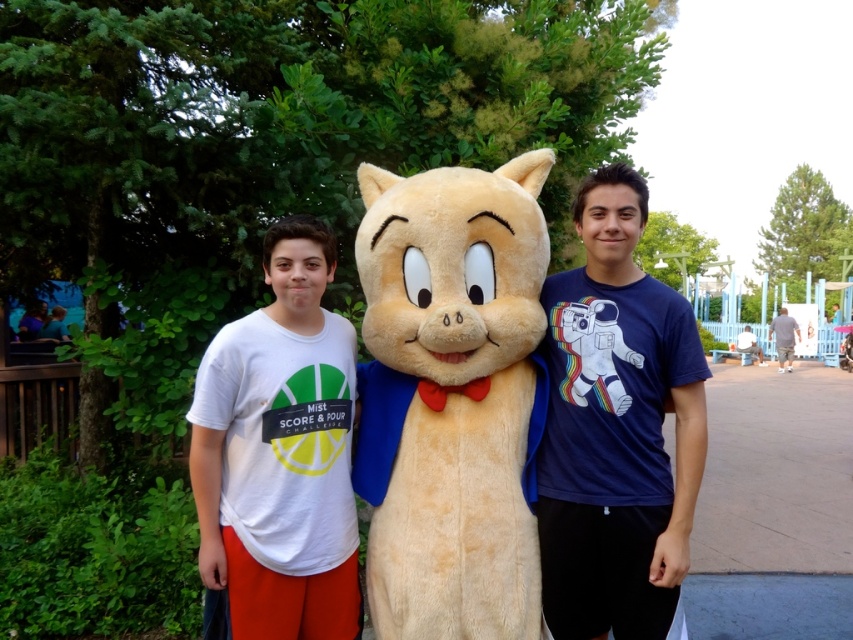
You are a photographer trying to frame a photo of the gray cotton shirt at right and the beige cartoon cat costume in the center. Based on their positions, which object is closer to the bottom edge of the image?

The gray cotton shirt at right is closer to the bottom edge of the image because its position at point (784, 337) places it lower on the image plane compared to the beige cartoon cat costume in the center.